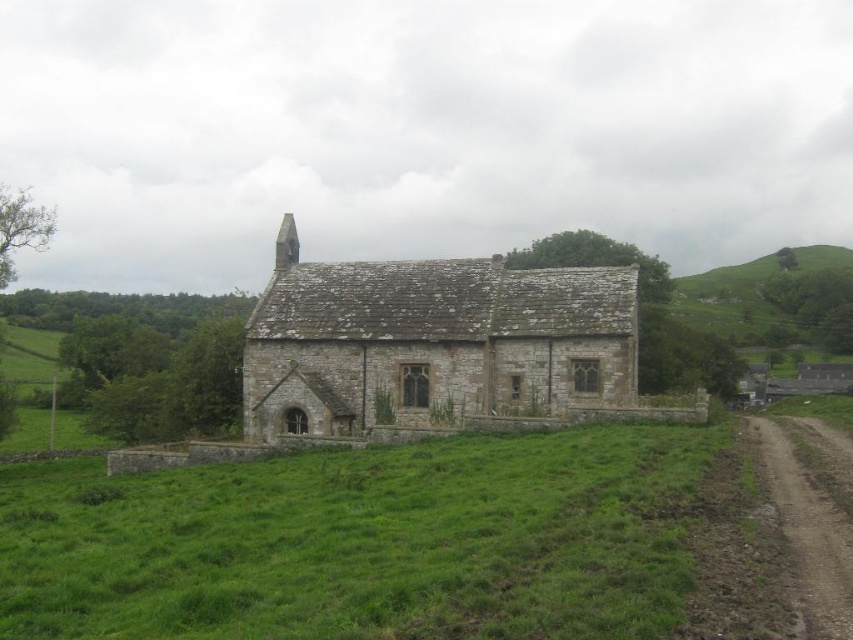
You are standing at the center of the grassy field in the rural scene. You see a point marked at coordinates (431, 340). What object is located at that point?

The point at (431, 340) marks the stone textured church at center.

You are a drone operator tasked with capturing aerial footage of the small stone building. The drone has a maximum flight range of 120 meters. Based on the scene, will the drone be able to fly from its current position near the camera to the green grassy hillside at upper right without exceeding its range?

The distance between the green grassy hillside at upper right and the camera is 122.76 meters, which exceeds the drone operator drone maximum flight range of 120 meters. Therefore, the drone will not be able to reach the green grassy hillside at upper right without exceeding its range.

You are standing at point A and want to walk to point B. The path between them is blocked by a large tree. You need to go around the tree. Which direction should you walk first to reach point B without crossing the tree? The two points are point A at coordinates point A is point [355,285] and point B is at point [791,492]. Please choose between left or right.

Since point A at coordinates [355,285] is behind point B at [791,492], you should walk to the right first to avoid the tree and reach point B.